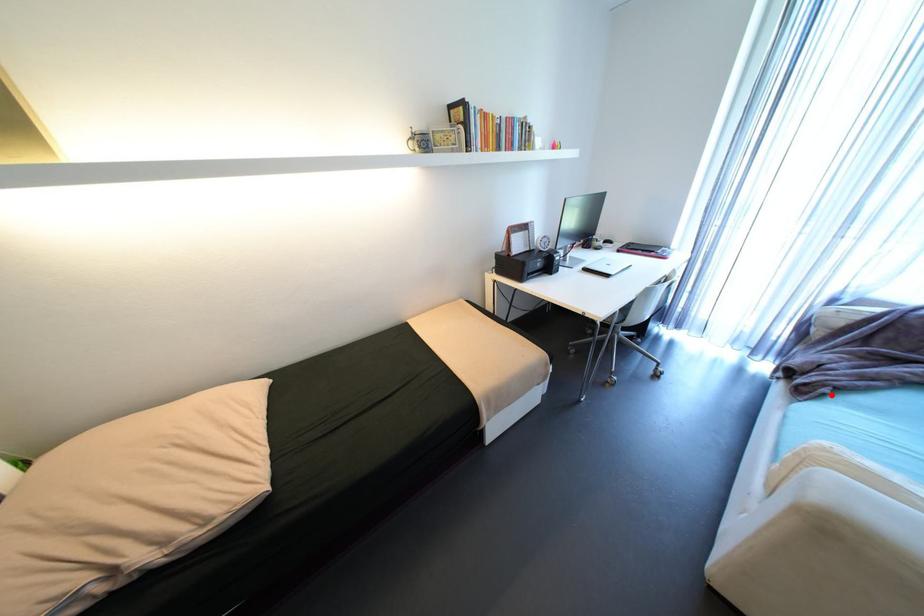
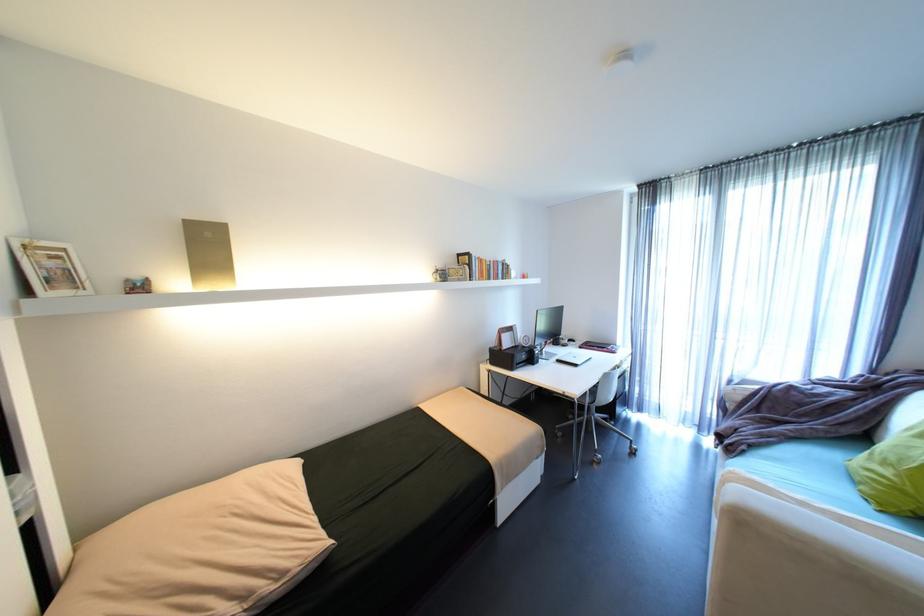
Question: I am providing you with two images of the same scene from different viewpoints. A red point is marked on the first image. Is the red point's position out of view in image 2?

Choices:
 (A) Yes
 (B) No

Answer: (B)